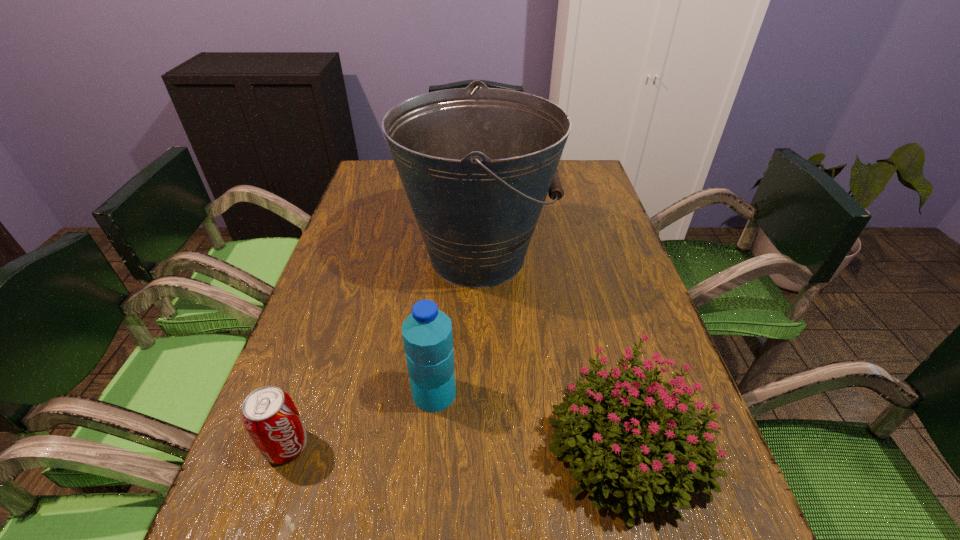
Locate an element on the screen. vacant position in the image that satisfies the following two spatial constraints: 1. with the handle on opposite sides of the tallest object; 2. on the front side of the water bottle is located at coordinates (476, 393).

This screenshot has width=960, height=540. I want to click on free spot that satisfies the following two spatial constraints: 1. with the handle on opposite sides of the farthest object; 2. on the front side of the shortest object, so click(476, 446).